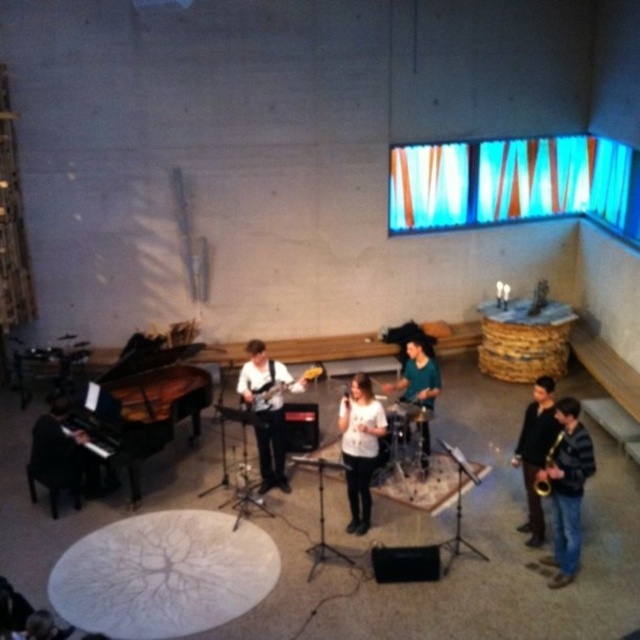
Is black polished piano at left closer to the viewer compared to matte black guitar at center?

Yes, it is in front of matte black guitar at center.

This screenshot has height=640, width=640. Describe the element at coordinates (144, 404) in the screenshot. I see `black polished piano at left` at that location.

This screenshot has width=640, height=640. I want to click on black polished piano at left, so click(x=144, y=404).

Consider the image. Does black piano at left appear on the left side of teal fabric shirt at center?

Result: Indeed, black piano at left is positioned on the left side of teal fabric shirt at center.

Can you confirm if black piano at left is bigger than teal fabric shirt at center?

Correct, black piano at left is larger in size than teal fabric shirt at center.

Between point (60, 481) and point (428, 392), which one is positioned behind?

The point (428, 392) is more distant.

The width and height of the screenshot is (640, 640). I want to click on black piano at left, so click(60, 456).

In the scene shown: Does black polished piano at left appear on the left side of teal fabric shirt at center?

Correct, you'll find black polished piano at left to the left of teal fabric shirt at center.

What do you see at coordinates (144, 404) in the screenshot? The height and width of the screenshot is (640, 640). I see `black polished piano at left` at bounding box center [144, 404].

You are a GUI agent. You are given a task and a screenshot of the screen. Output one action in this format:
    pyautogui.click(x=<x>, y=<y>)
    Task: Click on the black polished piano at left
    The width and height of the screenshot is (640, 640).
    Given the screenshot: What is the action you would take?
    pyautogui.click(x=144, y=404)